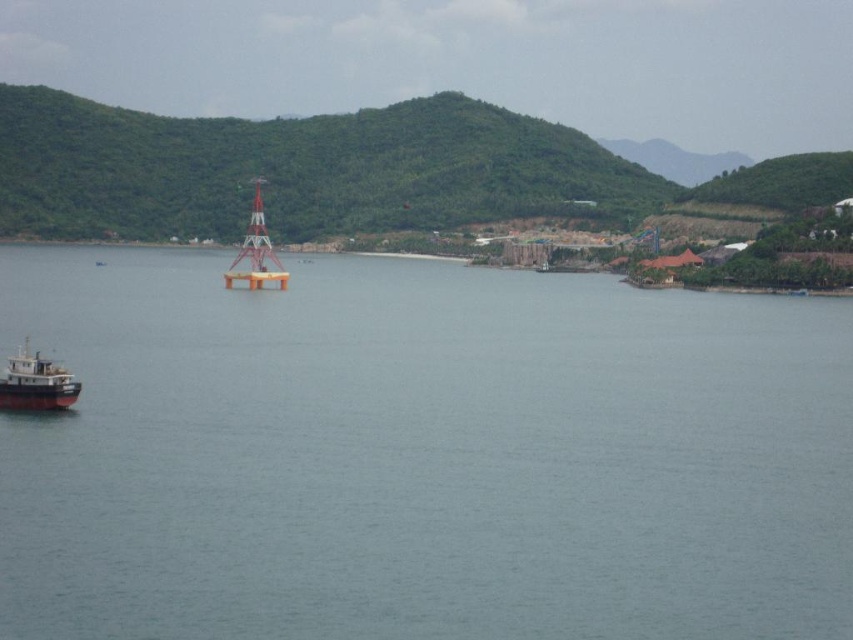
You are a sailor trying to navigate through the coastal scene. You see the transparent water at center and the brown matte boat at lower left. Which object is higher in the image?

The transparent water at center is taller than the brown matte boat at lower left, so the transparent water at center is higher in the image.

You are a photographer planning to capture the entire scene in one shot. Given that the transparent water at center and the brown matte boat at lower left must both be visible, which object should you focus on to ensure both are in frame without cropping?

The transparent water at center is wider than the brown matte boat at lower left, so focusing on the transparent water at center would ensure both objects are captured in the frame without cropping.

You are a marine biologist observing the coastal scene. You need to determine which object occupies a bigger area in the image between the transparent water at center and the brown matte boat at lower left. Which one is it?

The transparent water at center is larger in size than the brown matte boat at lower left, so the transparent water at center occupies a bigger area in the image.